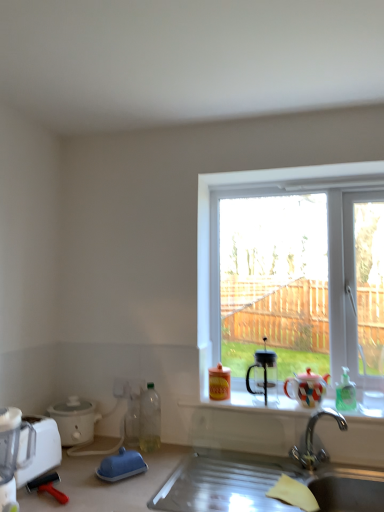
Question: Is point (117, 479) closer or farther from the camera than point (158, 415)?

Choices:
 (A) farther
 (B) closer

Answer: (B)

Question: Relative to translucent plastic bottle at lower left, arranged as the 3th bottle when viewed from the right, is blue rubber squeegee at lower left, which ranks as the third appliance in left-to-right order, in front or behind?

Choices:
 (A) front
 (B) behind

Answer: (A)

Question: Which of these objects is positioned closest to the white matte slow cooker at lower left, arranged as the 2th appliance when viewed from the left?

Choices:
 (A) transparent glass coffee maker at window
 (B) metallic stainless steel sink at lower center
 (C) matte yellow plastic bottle at window, acting as the 2th bottle starting from the right
 (D) white plastic blender at lower left
 (E) translucent plastic bottle at lower left, arranged as the 3th bottle when viewed from the right

Answer: (B)

Question: Which of these objects is positioned farthest from the silver metallic faucet at lower center?

Choices:
 (A) matte ceramic teapot at window
 (B) blue rubber squeegee at lower left, arranged as the first appliance when viewed from the right
 (C) matte yellow plastic bottle at window, acting as the 2th bottle starting from the right
 (D) green translucent bottle at right, which appears as the first bottle when viewed from the right
 (E) matte ceramic cups at center

Answer: (B)